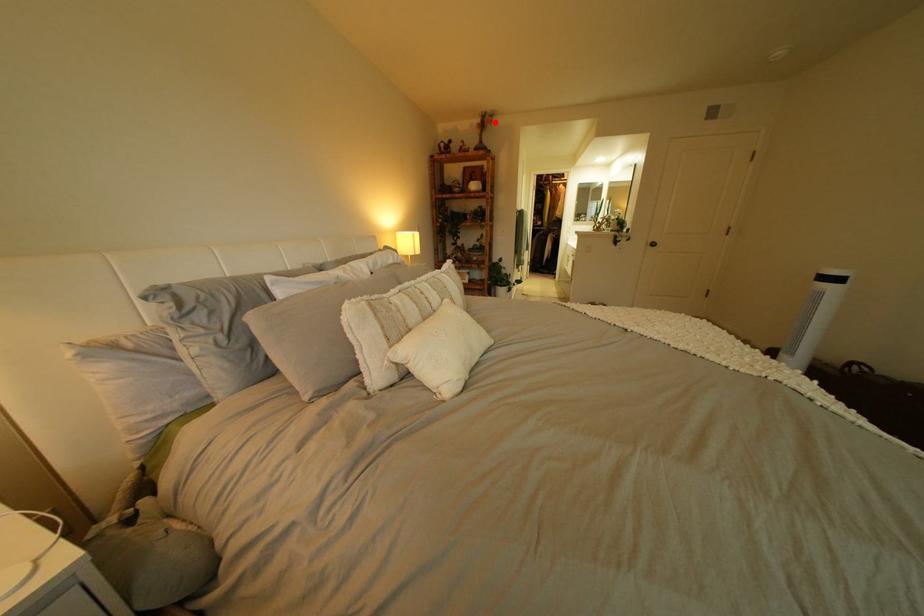
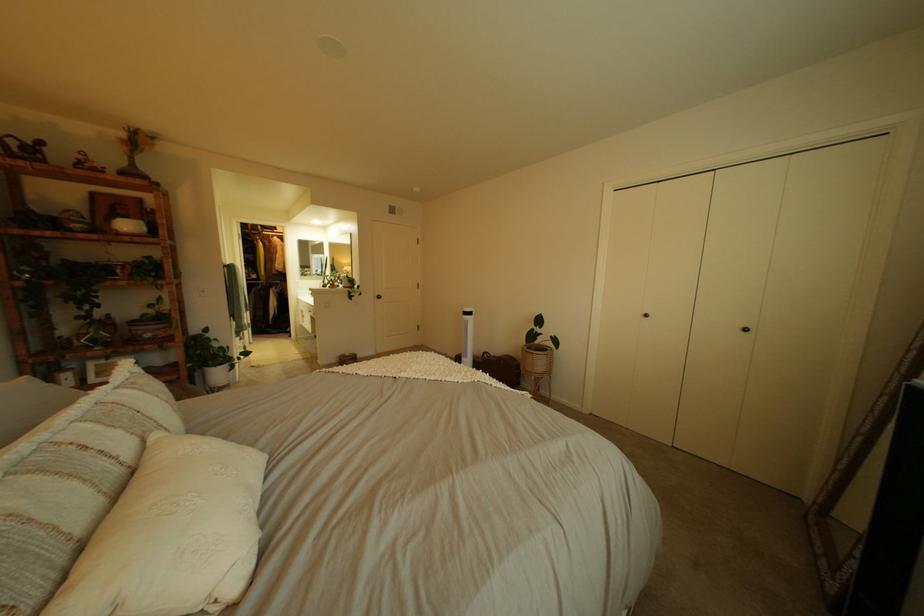
Question: I am providing you with two images of the same scene from different viewpoints. In image1, a red point is highlighted. Considering the same 3D point in image2, which of the following is correct?

Choices:
 (A) It is closer
 (B) It is farther

Answer: (B)